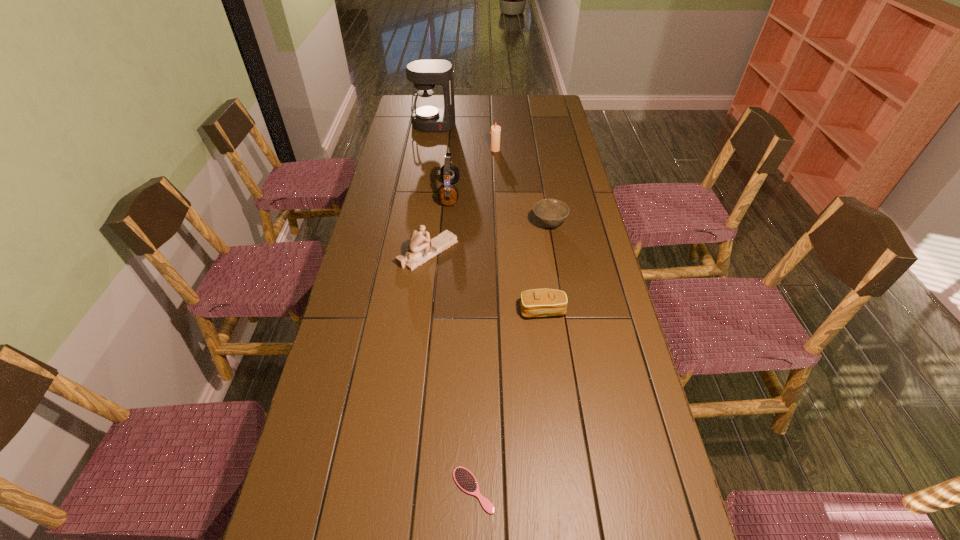
This screenshot has width=960, height=540. Find the location of `object that is the second closest to the nearest object`. object that is the second closest to the nearest object is located at coordinates (421, 249).

I want to click on blank area in the image that satisfies the following two spatial constraints: 1. on the front-facing side of the figurine; 2. on the left side of the nearest object, so click(x=399, y=490).